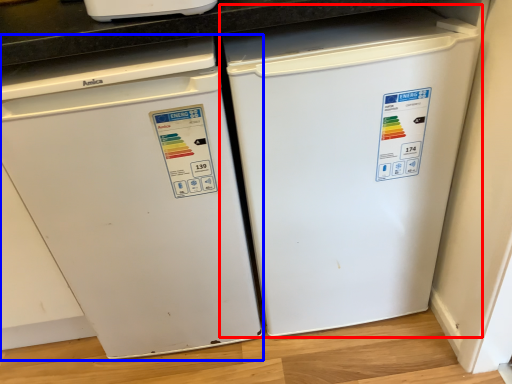
Question: Which object is further to the camera taking this photo, refrigerator (highlighted by a red box) or home appliance (highlighted by a blue box)?

Choices:
 (A) refrigerator
 (B) home appliance

Answer: (A)